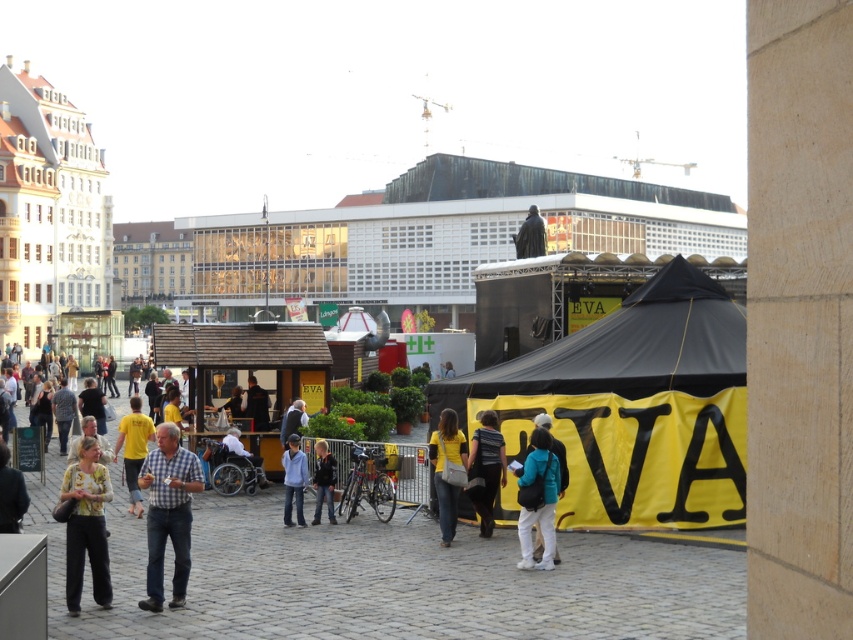
You are standing in the urban square and want to take a photo of both the point at coordinates (x=445, y=490) and the point at coordinates (x=4, y=484). Which point will appear closer to the bottom of the photo?

Point at coordinates (x=4, y=484) will appear closer to the bottom of the photo because it is closer to the camera than point at coordinates (x=445, y=490).

You are a delivery person standing at the printed fabric blouse at lower left and need to reach the teal fabric backpack at center to drop off a package. Considering the distance between them, can you estimate how long it would take you to walk there at a normal pace?

The distance between the printed fabric blouse at lower left and the teal fabric backpack at center is 15.02 meters. At a normal walking pace of approximately 1.4 meters per second, it would take roughly 10.7 seconds to cover this distance.